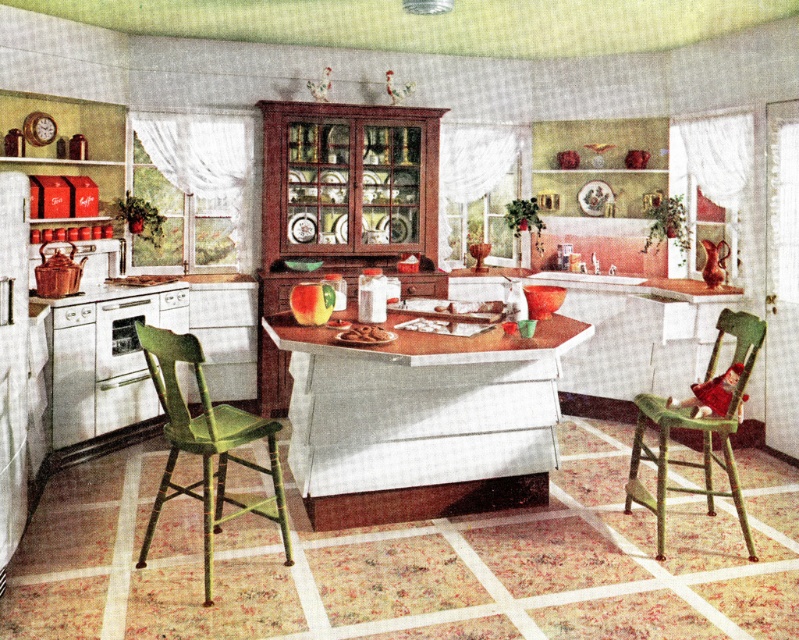
Question: Which of these objects is positioned closest to the green wood chair at lower right?

Choices:
 (A) wooden table at center
 (B) green wood chair at lower left

Answer: (A)

Question: Which of these objects is positioned farthest from the green wood chair at lower right?

Choices:
 (A) wooden table at center
 (B) green wood chair at lower left

Answer: (B)

Question: Among these objects, which one is nearest to the camera?

Choices:
 (A) green wood chair at lower left
 (B) wooden table at center

Answer: (A)

Question: Does wooden table at center have a smaller size compared to green wood chair at lower right?

Choices:
 (A) no
 (B) yes

Answer: (A)

Question: Can you confirm if green wood chair at lower left is wider than green wood chair at lower right?

Choices:
 (A) no
 (B) yes

Answer: (B)

Question: Does green wood chair at lower left appear over green wood chair at lower right?

Choices:
 (A) no
 (B) yes

Answer: (A)